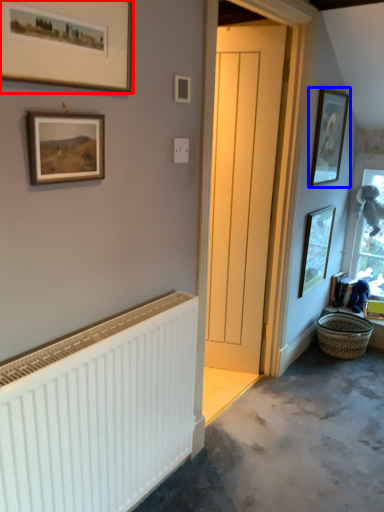
Question: Which of the following is the farthest to the observer, picture frame (highlighted by a red box) or picture frame (highlighted by a blue box)?

Choices:
 (A) picture frame
 (B) picture frame

Answer: (B)